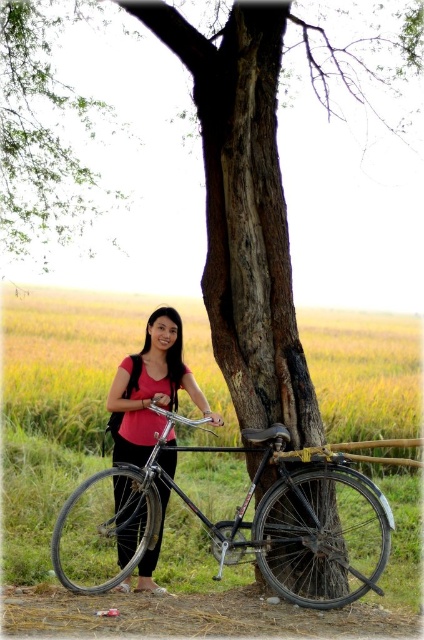
Question: Among these points, which one is nearest to the camera?

Choices:
 (A) (117, 477)
 (B) (47, 176)
 (C) (139, 413)

Answer: (A)

Question: Considering the real-world distances, which object is farthest from the matte pink shirt at center?

Choices:
 (A) shiny metallic bicycle at center
 (B) green leafy tree at upper left

Answer: (B)

Question: Does green leafy tree at upper left lie behind matte pink shirt at center?

Choices:
 (A) no
 (B) yes

Answer: (B)

Question: Which object is farther from the camera taking this photo?

Choices:
 (A) green leafy tree at upper left
 (B) matte pink shirt at center
 (C) shiny metallic bicycle at center

Answer: (A)

Question: Observing the image, what is the correct spatial positioning of shiny metallic bicycle at center in reference to matte pink shirt at center?

Choices:
 (A) above
 (B) below

Answer: (B)

Question: Can you confirm if green leafy tree at upper left is positioned below shiny metallic bicycle at center?

Choices:
 (A) no
 (B) yes

Answer: (A)